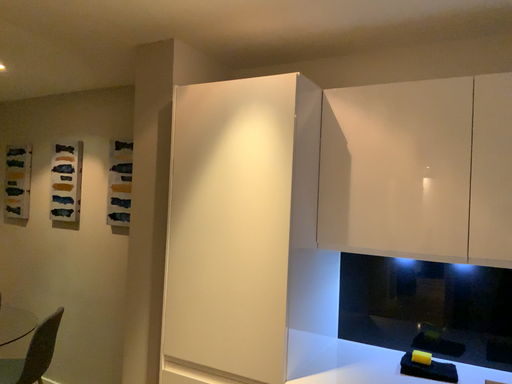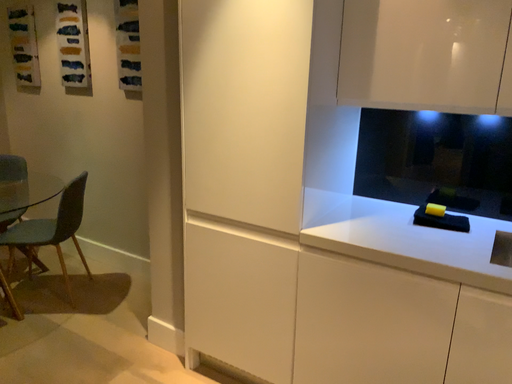
Question: How did the camera likely rotate when shooting the video?

Choices:
 (A) rotated upward
 (B) rotated downward

Answer: (B)